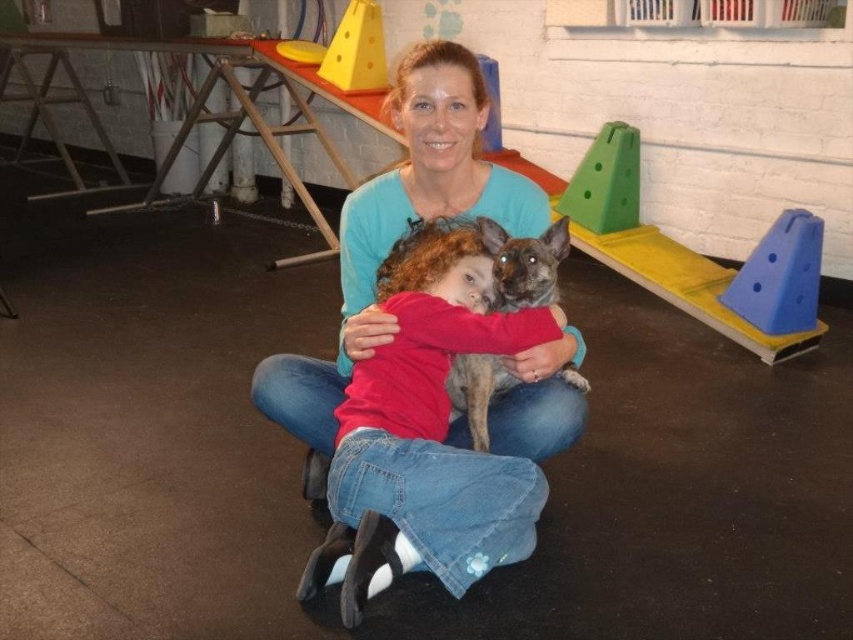
Question: Which point is farther from the camera taking this photo?

Choices:
 (A) (318, 404)
 (B) (546, 275)

Answer: (A)

Question: Considering the relative positions of matte blue shirt at center and speckled fur dog at center in the image provided, where is matte blue shirt at center located with respect to speckled fur dog at center?

Choices:
 (A) above
 (B) below

Answer: (A)

Question: Does matte blue shirt at center appear on the right side of speckled fur dog at center?

Choices:
 (A) no
 (B) yes

Answer: (A)

Question: Is matte blue shirt at center to the right of speckled fur dog at center from the viewer's perspective?

Choices:
 (A) yes
 (B) no

Answer: (B)